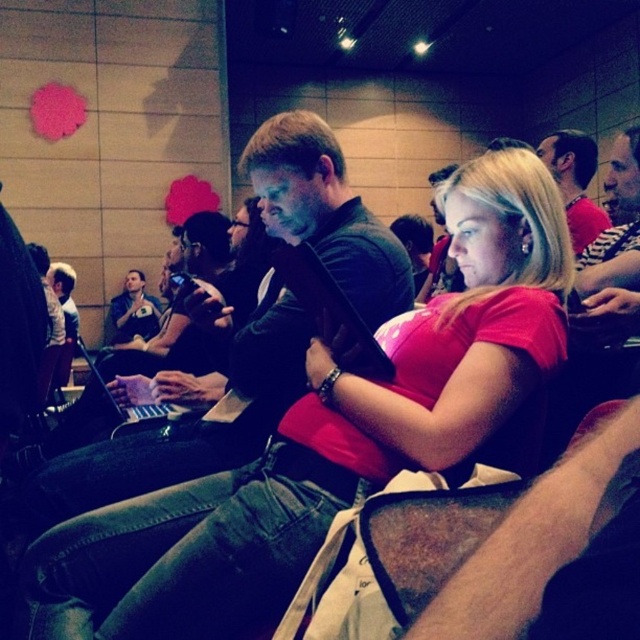
You are a photographer trying to capture a candid shot of both the matte pink shirt at center and the striped shirt at upper right. Since you want to ensure both are in focus, you need to know which one is closer to you. Can you determine which is nearer?

The matte pink shirt at center is closer to the viewer than the striped shirt at upper right, so you should focus on the matte pink shirt at center first as it is nearer.

You are organizing a photo shoot and need to place a small prop between the matte pink shirt at center and the striped shirt at upper right. Given their sizes, which shirt should the prop be closer to?

The matte pink shirt at center is larger in size than the striped shirt at upper right, so the prop should be placed closer to the striped shirt at upper right to balance the visual weight.

You are a photographer trying to take a clear photo of the matte black laptop at left without the striped shirt at upper right blocking it. How should you adjust your position?

Move to the right side so that the striped shirt at upper right is no longer in front of the matte black laptop at left, allowing an unobstructed view.